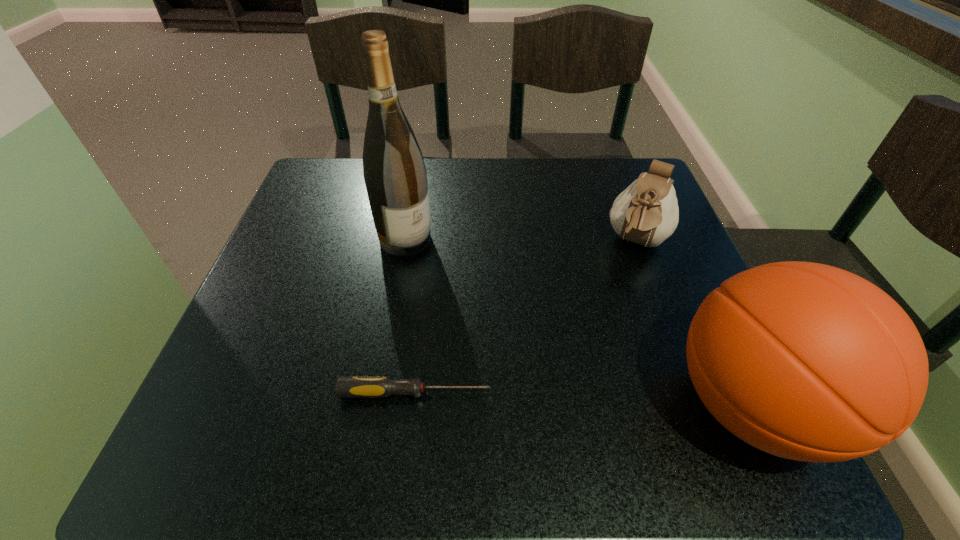
The height and width of the screenshot is (540, 960). In the image, there is a desktop. What are the coordinates of `vacant space at the far left corner` in the screenshot? It's located at (335, 210).

In the image, there is a desktop. At what (x,y) coordinates should I click in order to perform the action: click on free space at the near left corner. Please return your answer as a coordinate pair (x, y). The image size is (960, 540). Looking at the image, I should click on (261, 384).

Where is `free space at the far right corner of the desktop`? The image size is (960, 540). free space at the far right corner of the desktop is located at coordinates (644, 163).

Image resolution: width=960 pixels, height=540 pixels. Find the location of `empty location between the tallest object and the third tallest object`. empty location between the tallest object and the third tallest object is located at coordinates (521, 240).

Identify the location of unoccupied position between the shortest object and the third shortest object. (584, 399).

You are a GUI agent. You are given a task and a screenshot of the screen. Output one action in this format:
    pyautogui.click(x=<x>, y=<y>)
    Task: Click on the free space between the shortest object and the basketball
    This screenshot has width=960, height=540.
    Given the screenshot: What is the action you would take?
    pyautogui.click(x=584, y=399)

This screenshot has width=960, height=540. I want to click on empty location between the wine bottle and the pouch, so click(521, 240).

You are a GUI agent. You are given a task and a screenshot of the screen. Output one action in this format:
    pyautogui.click(x=<x>, y=<y>)
    Task: Click on the vacant point located between the screwdriver and the basketball
    
    Given the screenshot: What is the action you would take?
    pyautogui.click(x=584, y=399)

The width and height of the screenshot is (960, 540). In order to click on free spot between the screwdriver and the basketball in this screenshot , I will do `click(584, 399)`.

In order to click on the third closest object to the shortest object in this screenshot , I will do `click(646, 212)`.